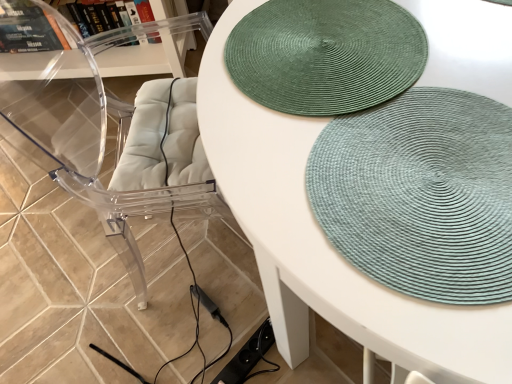
Identify the location of vacant space in front of green woven mat at upper center, the 2th mat ordered from the bottom. This screenshot has width=512, height=384. (373, 192).